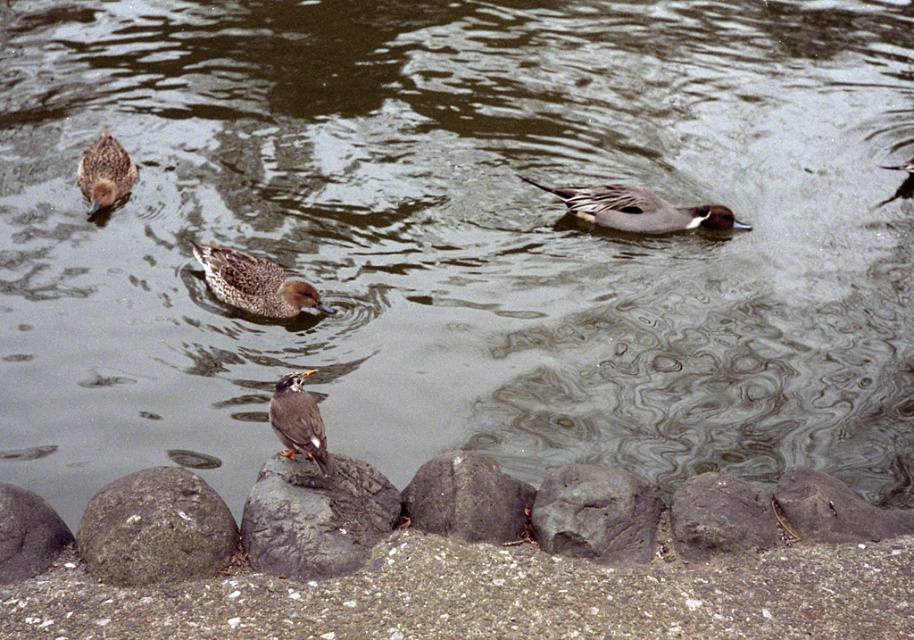
You are a small dog who wants to jump across the gap between the rough gray rock at lower left and the gray rough rock at lower right. Your maximum jumping distance is 1.8 meters. Can you make the jump?

The rough gray rock at lower left is 1.93 meters from the gray rough rock at lower right. Since your maximum jumping distance is 1.8 meters, you cannot make the jump.

You are standing at the edge of the water and want to place a small potted plant between the rough gray rock at lower left and the gray rough rock at center. Which rock should you use as a reference point to ensure the plant is closer to the smaller rock?

The rough gray rock at lower left is smaller than the gray rough rock at center. To place the plant closer to the smaller rock, use the rough gray rock at lower left as your reference point.

You are standing at the edge of the water and see the rough gray rock at lower left and the gray rough rock at lower right. Which rock is positioned higher relative to the other?

The rough gray rock at lower left is located above the gray rough rock at lower right, so it is positioned higher.